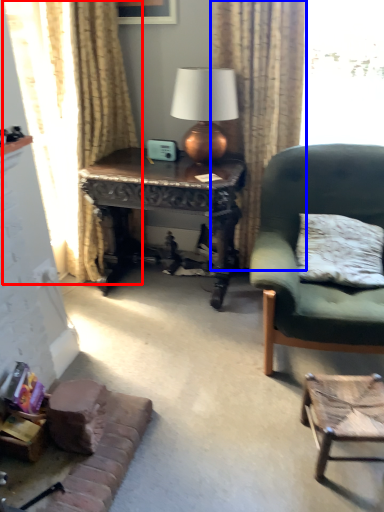
Question: Which point is further to the camera, curtain (highlighted by a red box) or curtain (highlighted by a blue box)?

Choices:
 (A) curtain
 (B) curtain

Answer: (B)